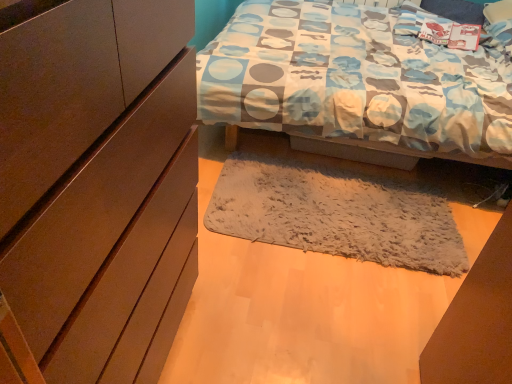
What do you see at coordinates (336, 214) in the screenshot? I see `fuzzy gray mat at center` at bounding box center [336, 214].

Locate an element on the screen. The height and width of the screenshot is (384, 512). fuzzy gray mat at center is located at coordinates (336, 214).

In order to face fuzzy gray mat at center, should I rotate leftwards or rightwards?

You should look right and rotate roughly 11.340 degrees.

Locate an element on the screen. The image size is (512, 384). matte brown cabinet at left is located at coordinates (99, 185).

Describe the element at coordinates (99, 185) in the screenshot. This screenshot has height=384, width=512. I see `matte brown cabinet at left` at that location.

At what (x,y) coordinates should I click in order to perform the action: click on fuzzy gray mat at center. Please return your answer as a coordinate pair (x, y). Image resolution: width=512 pixels, height=384 pixels. Looking at the image, I should click on (336, 214).

Which object is positioned more to the right, fuzzy gray mat at center or matte brown cabinet at left?

fuzzy gray mat at center.

Considering the relative positions of fuzzy gray mat at center and matte brown cabinet at left in the image provided, is fuzzy gray mat at center behind matte brown cabinet at left?

Yes.

Considering the points (283, 229) and (37, 134), which point is in front, point (283, 229) or point (37, 134)?

The point (37, 134) is closer.

Consider the image. From the image's perspective, between fuzzy gray mat at center and matte brown cabinet at left, who is located below?

matte brown cabinet at left, from the image's perspective.

From a real-world perspective, is fuzzy gray mat at center physically located above or below matte brown cabinet at left?

In terms of real-world spatial position, fuzzy gray mat at center is below matte brown cabinet at left.

Considering the sizes of objects fuzzy gray mat at center and matte brown cabinet at left in the image provided, who is wider, fuzzy gray mat at center or matte brown cabinet at left?

fuzzy gray mat at center.

From their relative heights in the image, would you say fuzzy gray mat at center is taller or shorter than matte brown cabinet at left?

fuzzy gray mat at center is shorter than matte brown cabinet at left.

Does fuzzy gray mat at center have a smaller size compared to matte brown cabinet at left?

Yes, fuzzy gray mat at center is smaller than matte brown cabinet at left.

Can matte brown cabinet at left be found inside fuzzy gray mat at center?

No, matte brown cabinet at left is located outside of fuzzy gray mat at center.

Is fuzzy gray mat at center next to matte brown cabinet at left and touching it?

No, fuzzy gray mat at center is not beside matte brown cabinet at left.

Is fuzzy gray mat at center oriented towards matte brown cabinet at left?

No, fuzzy gray mat at center is not facing towards matte brown cabinet at left.

How many degrees apart are the facing directions of fuzzy gray mat at center and matte brown cabinet at left?

90.9 degrees.

What are the coordinates of `cabinetry that appears above the fuzzy gray mat at center (from a real-world perspective)` in the screenshot? It's located at (99, 185).

Is matte brown cabinet at left to the left or to the right of fuzzy gray mat at center in the image?

In the image, matte brown cabinet at left appears on the left side of fuzzy gray mat at center.

Relative to fuzzy gray mat at center, is matte brown cabinet at left in front or behind?

In the image, matte brown cabinet at left appears in front of fuzzy gray mat at center.

Is point (16, 307) less distant than point (387, 260)?

Yes, point (16, 307) is in front of point (387, 260).

From the image's perspective, is matte brown cabinet at left located beneath fuzzy gray mat at center?

Correct, matte brown cabinet at left appears lower than fuzzy gray mat at center in the image.

From a real-world perspective, is matte brown cabinet at left below fuzzy gray mat at center?

Incorrect, from a real-world perspective, matte brown cabinet at left is higher than fuzzy gray mat at center.

Looking at their sizes, would you say matte brown cabinet at left is wider or thinner than fuzzy gray mat at center?

Clearly, matte brown cabinet at left has less width compared to fuzzy gray mat at center.

Considering the relative sizes of matte brown cabinet at left and fuzzy gray mat at center in the image provided, is matte brown cabinet at left taller than fuzzy gray mat at center?

Correct, matte brown cabinet at left is much taller as fuzzy gray mat at center.

Who is bigger, matte brown cabinet at left or fuzzy gray mat at center?

matte brown cabinet at left.

Can we say matte brown cabinet at left lies outside fuzzy gray mat at center?

That's correct, matte brown cabinet at left is outside of fuzzy gray mat at center.

Is matte brown cabinet at left not near fuzzy gray mat at center?

matte brown cabinet at left is positioned a significant distance from fuzzy gray mat at center.

Is matte brown cabinet at left positioned with its back to fuzzy gray mat at center?

No, matte brown cabinet at left is not facing the opposite direction of fuzzy gray mat at center.

Can you tell me how much matte brown cabinet at left and fuzzy gray mat at center differ in facing direction?

They differ by 90.9 degrees in their facing directions.

Looking at this image, measure the distance between matte brown cabinet at left and fuzzy gray mat at center.

matte brown cabinet at left is 1.03 meters from fuzzy gray mat at center.

Where is `mat above the matte brown cabinet at left (from the image's perspective)`? This screenshot has height=384, width=512. mat above the matte brown cabinet at left (from the image's perspective) is located at coordinates (336, 214).

The image size is (512, 384). I want to click on cabinetry located above the fuzzy gray mat at center (from a real-world perspective), so click(99, 185).

Where is `cabinetry in front of the fuzzy gray mat at center`? This screenshot has height=384, width=512. cabinetry in front of the fuzzy gray mat at center is located at coordinates tap(99, 185).